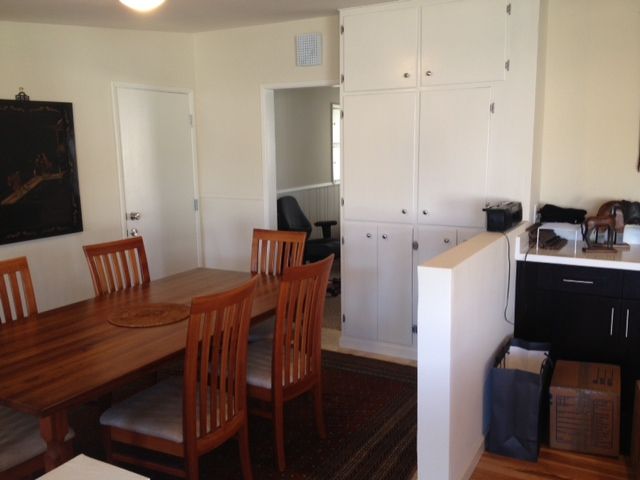
Where is `white counter top`? The height and width of the screenshot is (480, 640). white counter top is located at coordinates (623, 264).